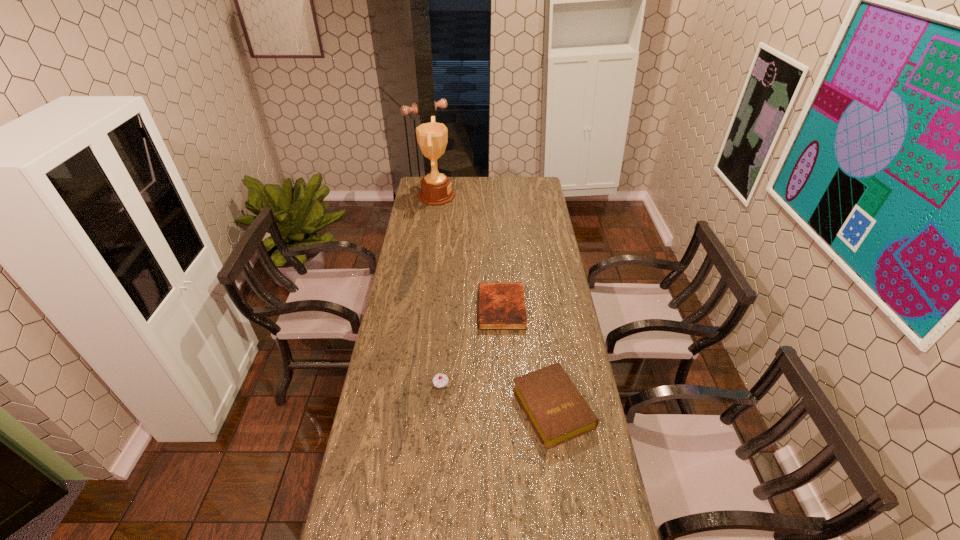
Identify the location of the tallest object. pyautogui.click(x=436, y=190).

The image size is (960, 540). I want to click on award, so click(436, 190).

At what (x,y) coordinates should I click in order to perform the action: click on cupcake. Please return your answer as a coordinate pair (x, y). The height and width of the screenshot is (540, 960). Looking at the image, I should click on (440, 381).

Locate an element on the screen. The height and width of the screenshot is (540, 960). the third tallest object is located at coordinates (556, 409).

The width and height of the screenshot is (960, 540). What are the coordinates of `the taller Bible` in the screenshot? It's located at (556, 409).

Identify the location of the shortest object. (501, 306).

What are the coordinates of `the third nearest object` in the screenshot? It's located at (501, 306).

The image size is (960, 540). Find the location of `free region located 0.130m on the front-facing side of the tallest object`. free region located 0.130m on the front-facing side of the tallest object is located at coordinates (479, 196).

Identify the location of vacant point located 0.140m on the right of the cupcake. This screenshot has height=540, width=960. (491, 386).

Where is `vacant space situated 0.290m on the left of the second shortest object`? The height and width of the screenshot is (540, 960). vacant space situated 0.290m on the left of the second shortest object is located at coordinates (425, 408).